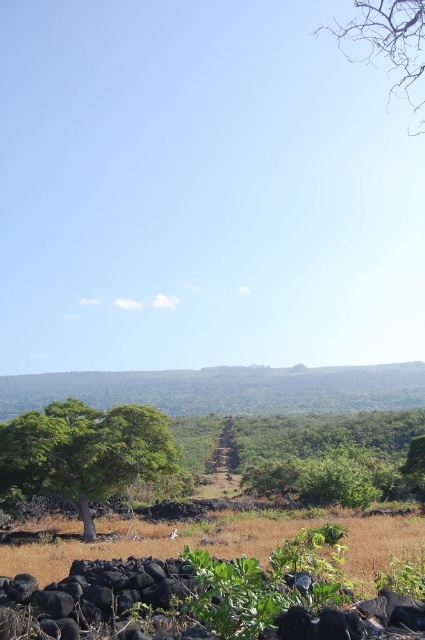
You are an environmental scientist observing this landscape. You notice the green leafy tree at left and the bare branches at upper right. Which of these two objects is positioned lower in the image?

The green leafy tree at left is positioned lower in the image than the bare branches at upper right.

You are an environmental scientist observing the landscape. You notice the green leafy tree at left and the bare branches at upper right. Which of these two objects has a greater height in the scene?

The bare branches at upper right are taller than the green leafy tree at left.

You are a hiker trying to estimate distances in the landscape. You see the green leafy tree at left and the bare branches at upper right. Which object is farther from your current position?

The green leafy tree at left is 50.05 meters away from the bare branches at upper right. Since the distance between them is given, but the question asks which is farther from your current position, we cannot determine that without knowing your exact location. However, if you are equidistant from both, the green leafy tree at left would be farther from the bare branches at upper right by 50.05 meters.